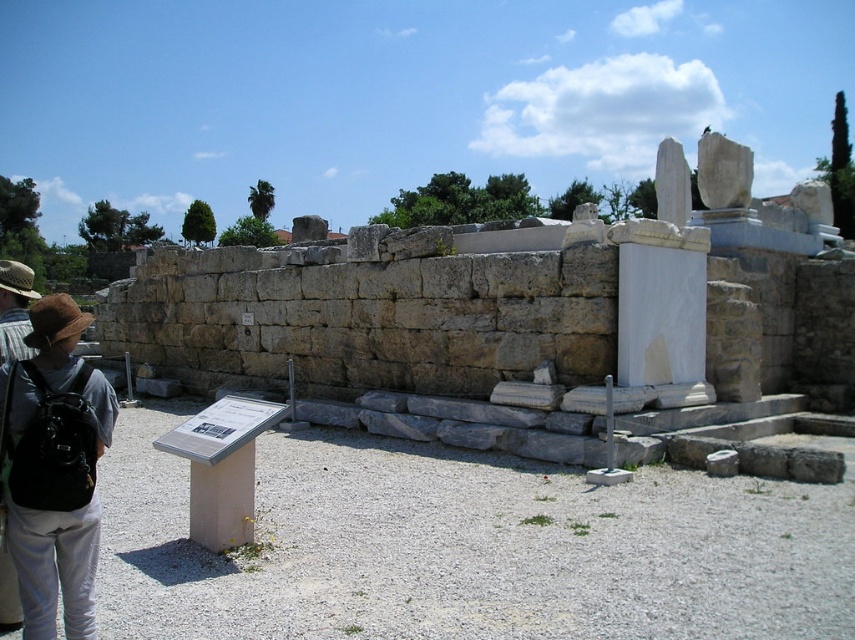
You are a tour guide at the archaeological site. You need to direct a visitor to the brown fabric backpack at lower left, which contains first aid supplies. The visitor is currently facing the stone wall at center. Which direction should they move to reach the backpack?

The visitor should move away from the stone wall at center towards the foreground since the brown fabric backpack at lower left is closer to the viewer than the wall.

You are standing at the archaeological site and want to take a photo of both the large stone wall and the white marble fragments. You notice two points marked as reference points for your camera. The first point is labeled as point [146,355] and the second as point [92,481]. Which point should you position your camera closer to so that both objects are in frame without needing to move the camera?

You should position your camera closer to point [92,481] because point [146,355] is behind it. This placement will ensure both the large stone wall and the white marble fragments are visible in the frame without needing to move the camera.